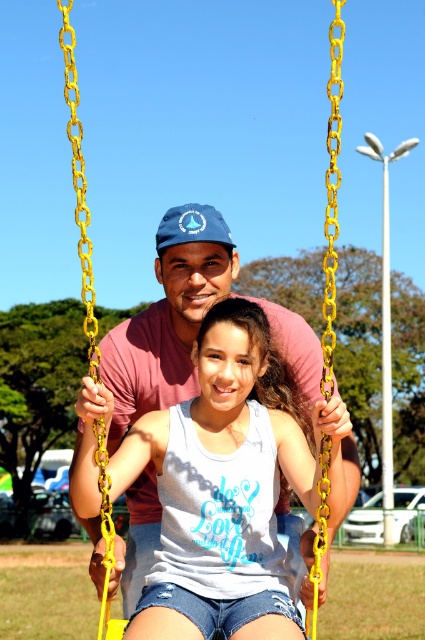
Is white cotton tank top at center to the right of blue fabric baseball cap at center from the viewer's perspective?

Indeed, white cotton tank top at center is positioned on the right side of blue fabric baseball cap at center.

Based on the photo, does white cotton tank top at center have a lesser width compared to blue fabric baseball cap at center?

No, white cotton tank top at center is not thinner than blue fabric baseball cap at center.

Which is behind, point (261, 634) or point (198, 212)?

The point (198, 212) is behind.

Identify the location of white cotton tank top at center. The image size is (425, 640). (238, 412).